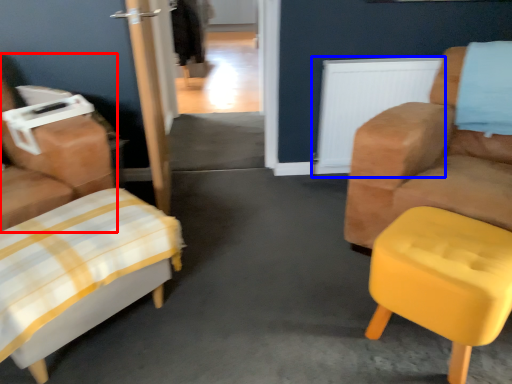
Question: Among these objects, which one is nearest to the camera, chair (highlighted by a red box) or radiator (highlighted by a blue box)?

Choices:
 (A) chair
 (B) radiator

Answer: (A)